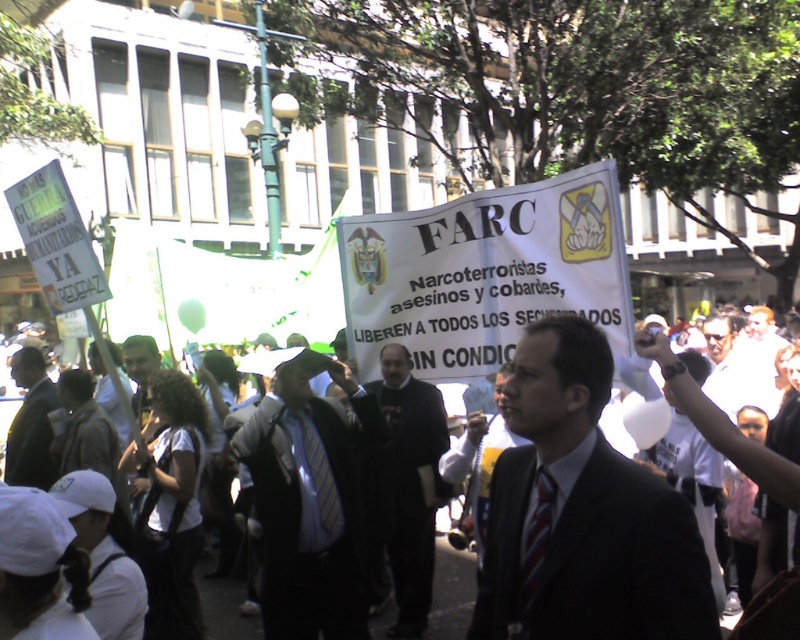
Can you confirm if black matte suit at center is positioned below white paper banner at center?

Actually, black matte suit at center is above white paper banner at center.

Between black matte suit at center and white paper banner at center, which one appears on the left side from the viewer's perspective?

Positioned to the left is black matte suit at center.

The image size is (800, 640). In order to click on black matte suit at center in this screenshot , I will do `click(410, 483)`.

Who is taller, black matte suit at center or matte black suit at center?

With more height is black matte suit at center.

Is black matte suit at center to the right of matte black suit at center from the viewer's perspective?

Correct, you'll find black matte suit at center to the right of matte black suit at center.

Does point (396, 440) come farther from viewer compared to point (29, 420)?

That is False.

Find the location of a particular element. The width and height of the screenshot is (800, 640). black matte suit at center is located at coordinates [x=410, y=483].

Is dark suit at center closer to camera compared to black matte suit at center?

Yes, it is.

Is point (708, 636) positioned after point (398, 355)?

No, (708, 636) is in front of (398, 355).

Identify the location of dark suit at center. (582, 513).